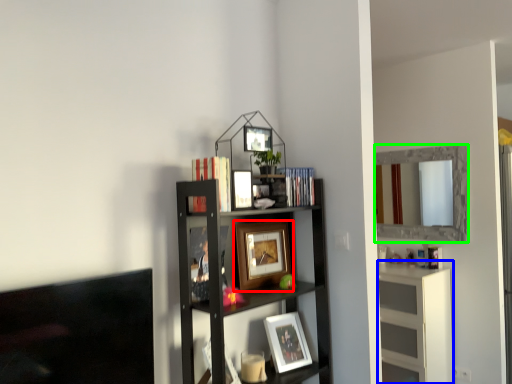
Question: Which object is positioned closest to picture frame (highlighted by a red box)? Select from cabinet (highlighted by a blue box) and mirror (highlighted by a green box).

Choices:
 (A) cabinet
 (B) mirror

Answer: (A)